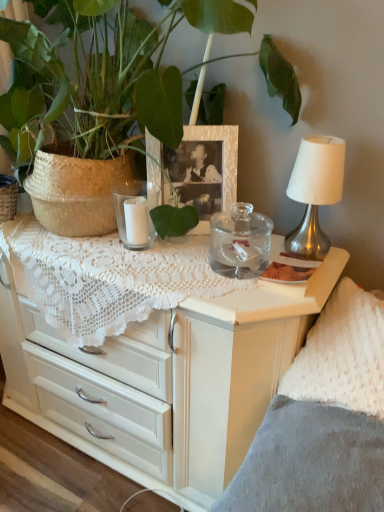
Question: Considering the positions of transparent glass jar at center, positioned as the 1th candle holder in right-to-left order, and white glass candle at center, placed as the second candle holder when sorted from right to left, in the image, is transparent glass jar at center, positioned as the 1th candle holder in right-to-left order, taller or shorter than white glass candle at center, placed as the second candle holder when sorted from right to left,?

Choices:
 (A) short
 (B) tall

Answer: (A)

Question: Does point (266, 224) appear closer or farther from the camera than point (125, 193)?

Choices:
 (A) farther
 (B) closer

Answer: (A)

Question: Which object is positioned farthest from the transparent glass jar at center, positioned as the 1th candle holder in right-to-left order?

Choices:
 (A) silver metallic table lamp at upper right
 (B) white textured picture frame at center
 (C) white lace chest of drawers at upper center
 (D) green woven basket at upper left
 (E) white fluffy pillow at right

Answer: (D)

Question: Which object is the closest to the white lace chest of drawers at upper center?

Choices:
 (A) gray fabric at lower right
 (B) white textured picture frame at center
 (C) silver metallic table lamp at upper right
 (D) green woven basket at upper left
 (E) white fluffy pillow at right

Answer: (E)